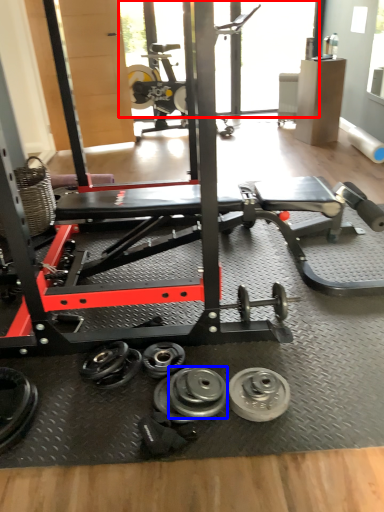
Question: Which object is further to the camera taking this photo, window screen (highlighted by a red box) or dumbbell (highlighted by a blue box)?

Choices:
 (A) window screen
 (B) dumbbell

Answer: (A)